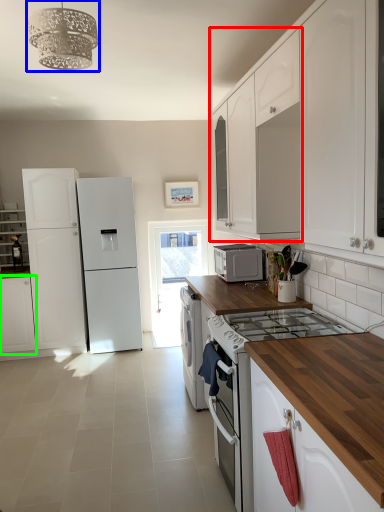
Question: Which object is positioned closest to cabinetry (highlighted by a red box)? Select from light fixture (highlighted by a blue box) and cabinetry (highlighted by a green box).

Choices:
 (A) light fixture
 (B) cabinetry

Answer: (A)